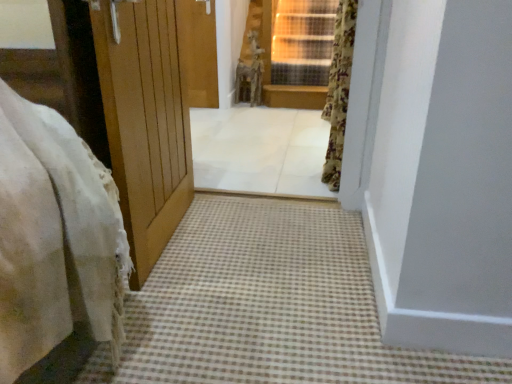
Question: From a real-world perspective, is brown checkered carpet at lower center positioned under white tile floor at center based on gravity?

Choices:
 (A) no
 (B) yes

Answer: (B)

Question: From the image's perspective, is brown checkered carpet at lower center beneath white tile floor at center?

Choices:
 (A) no
 (B) yes

Answer: (B)

Question: Does brown checkered carpet at lower center have a greater width compared to white tile floor at center?

Choices:
 (A) no
 (B) yes

Answer: (A)

Question: Does brown checkered carpet at lower center appear on the right side of white tile floor at center?

Choices:
 (A) yes
 (B) no

Answer: (A)

Question: Would you say brown checkered carpet at lower center is a long distance from white tile floor at center?

Choices:
 (A) yes
 (B) no

Answer: (A)

Question: Can we say brown checkered carpet at lower center lies outside white tile floor at center?

Choices:
 (A) no
 (B) yes

Answer: (B)

Question: Considering the relative positions of brown checkered carpet at lower center and floral fabric curtain at upper right in the image provided, is brown checkered carpet at lower center behind floral fabric curtain at upper right?

Choices:
 (A) no
 (B) yes

Answer: (A)

Question: Is brown checkered carpet at lower center positioned before floral fabric curtain at upper right?

Choices:
 (A) no
 (B) yes

Answer: (B)

Question: Can you confirm if brown checkered carpet at lower center is wider than floral fabric curtain at upper right?

Choices:
 (A) no
 (B) yes

Answer: (B)

Question: Can you confirm if brown checkered carpet at lower center is smaller than floral fabric curtain at upper right?

Choices:
 (A) no
 (B) yes

Answer: (A)

Question: Considering the relative positions of brown checkered carpet at lower center and floral fabric curtain at upper right in the image provided, is brown checkered carpet at lower center to the right of floral fabric curtain at upper right from the viewer's perspective?

Choices:
 (A) no
 (B) yes

Answer: (A)

Question: From the image's perspective, is brown checkered carpet at lower center above floral fabric curtain at upper right?

Choices:
 (A) no
 (B) yes

Answer: (A)

Question: From a real-world perspective, is white tile floor at center positioned over floral fabric curtain at upper right based on gravity?

Choices:
 (A) no
 (B) yes

Answer: (A)